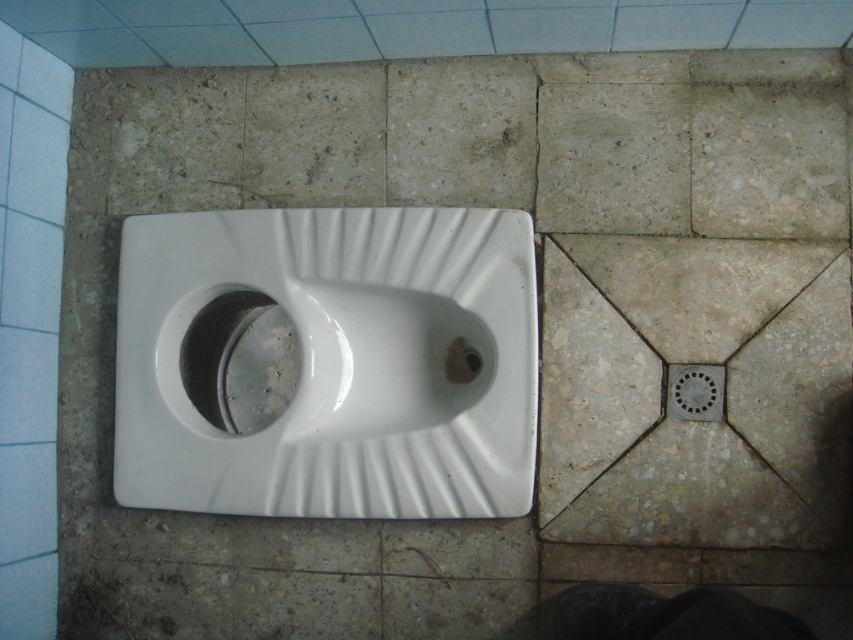
Does white glossy urinal at center appear on the left side of black rubber drain at center?

Correct, you'll find white glossy urinal at center to the left of black rubber drain at center.

Between white glossy urinal at center and black rubber drain at center, which one appears on the left side from the viewer's perspective?

white glossy urinal at center

Does point (496, 314) come in front of point (473, 378)?

Yes, point (496, 314) is in front of point (473, 378).

You are a GUI agent. You are given a task and a screenshot of the screen. Output one action in this format:
    pyautogui.click(x=<x>, y=<y>)
    Task: Click on the white glossy urinal at center
    The height and width of the screenshot is (640, 853).
    Given the screenshot: What is the action you would take?
    pyautogui.click(x=335, y=362)

Based on the photo, is white glossy urinal at center positioned in front of matte metallic drain at lower right?

Yes, white glossy urinal at center is closer to the viewer.

Is white glossy urinal at center positioned at the back of matte metallic drain at lower right?

No.

Is point (126, 464) closer to viewer compared to point (688, 406)?

Yes, point (126, 464) is closer to viewer.

Image resolution: width=853 pixels, height=640 pixels. Identify the location of white glossy urinal at center. (335, 362).

Does matte metallic drain at lower right appear over black rubber drain at center?

Actually, matte metallic drain at lower right is below black rubber drain at center.

Is matte metallic drain at lower right to the right of black rubber drain at center from the viewer's perspective?

Yes, matte metallic drain at lower right is to the right of black rubber drain at center.

This screenshot has height=640, width=853. In order to click on matte metallic drain at lower right in this screenshot , I will do coord(695,392).

The width and height of the screenshot is (853, 640). I want to click on matte metallic drain at lower right, so click(x=695, y=392).